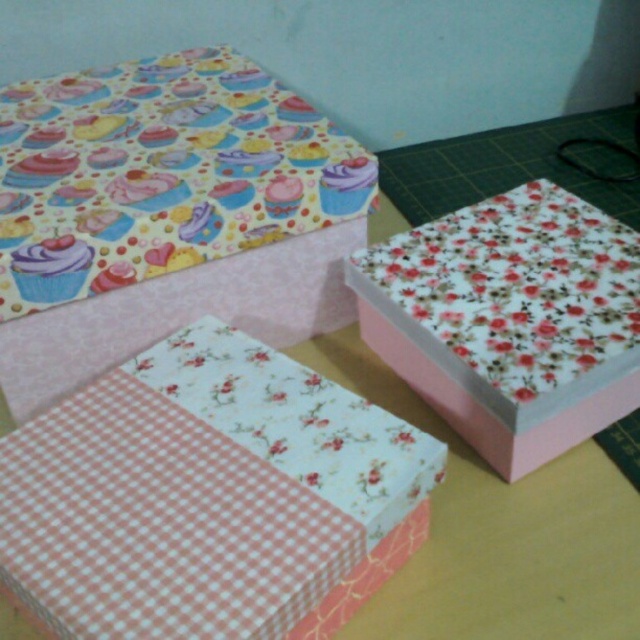
Measure the distance between pink checkered paper at lower left and camera.

pink checkered paper at lower left and camera are 71.87 centimeters apart.

Can you confirm if pink checkered paper at lower left is smaller than floral-patterned paper at center-right?

Yes, pink checkered paper at lower left is smaller than floral-patterned paper at center-right.

Between point (230, 534) and point (604, 328), which one is positioned in front?

Positioned in front is point (230, 534).

In order to click on pink checkered paper at lower left in this screenshot , I will do `click(209, 497)`.

How distant is pink checkered paper at lower left from cupcake-patterned fabric at upper left?

A distance of 11.36 inches exists between pink checkered paper at lower left and cupcake-patterned fabric at upper left.

What do you see at coordinates (209, 497) in the screenshot?
I see `pink checkered paper at lower left` at bounding box center [209, 497].

This screenshot has width=640, height=640. I want to click on pink checkered paper at lower left, so pos(209,497).

Describe the element at coordinates (209, 497) in the screenshot. I see `pink checkered paper at lower left` at that location.

Can you confirm if pink checkered paper at lower left is bigger than purple glossy cupcake at upper left?

A: Indeed, pink checkered paper at lower left has a larger size compared to purple glossy cupcake at upper left.

Identify the location of pink checkered paper at lower left. (209, 497).

This screenshot has height=640, width=640. Identify the location of pink checkered paper at lower left. (209, 497).